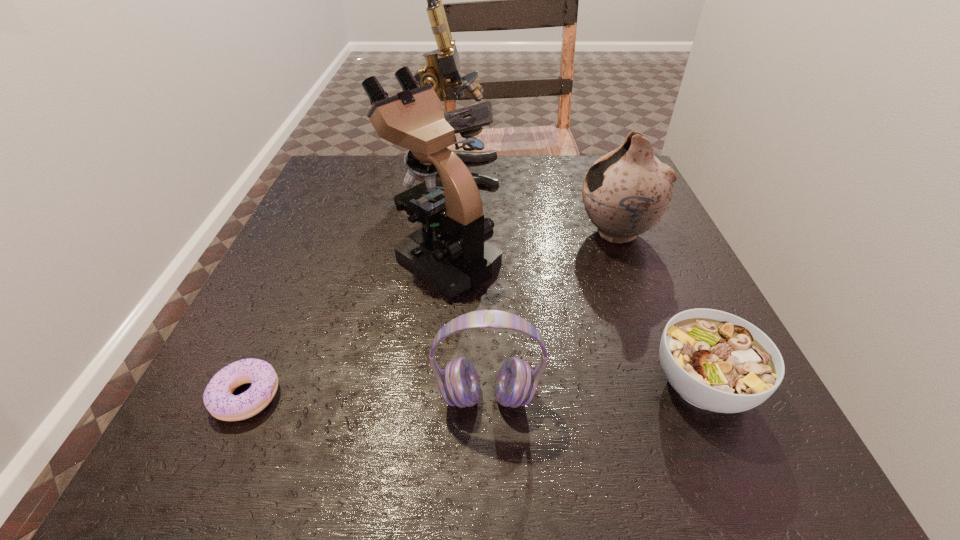
At what (x,y) coordinates should I click in order to perform the action: click on vacant space that satisfies the following two spatial constraints: 1. on the back side of the leftmost object; 2. on the left side of the second shortest object. Please return your answer as a coordinate pair (x, y). This screenshot has width=960, height=540. Looking at the image, I should click on (251, 385).

At what (x,y) coordinates should I click in order to perform the action: click on blank area in the image that satisfies the following two spatial constraints: 1. from the spout of the third tallest object; 2. on the back side of the fifth tallest object. Please return your answer as a coordinate pair (x, y). Image resolution: width=960 pixels, height=540 pixels. Looking at the image, I should click on (675, 385).